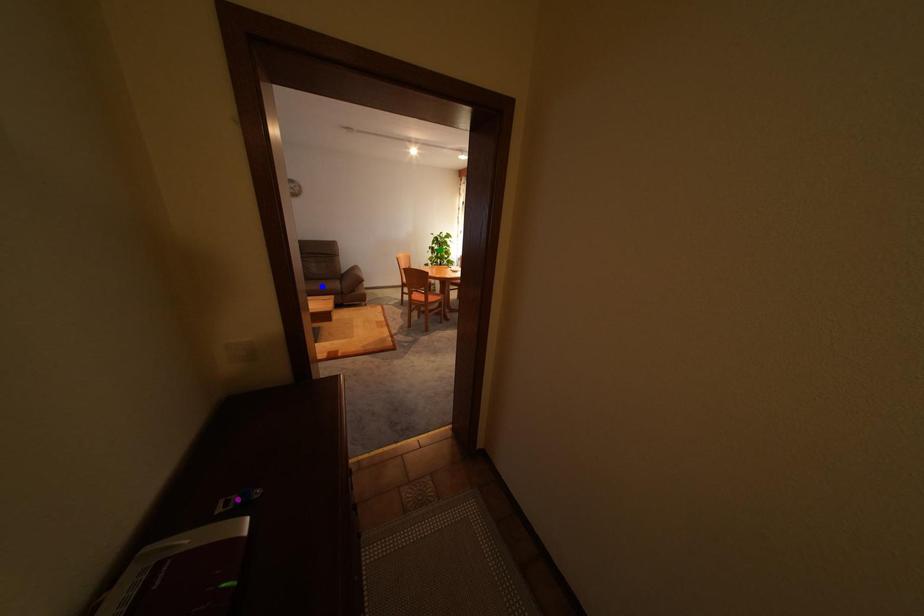
Order these from nearest to farthest:
1. blue point
2. green point
3. purple point

1. green point
2. blue point
3. purple point